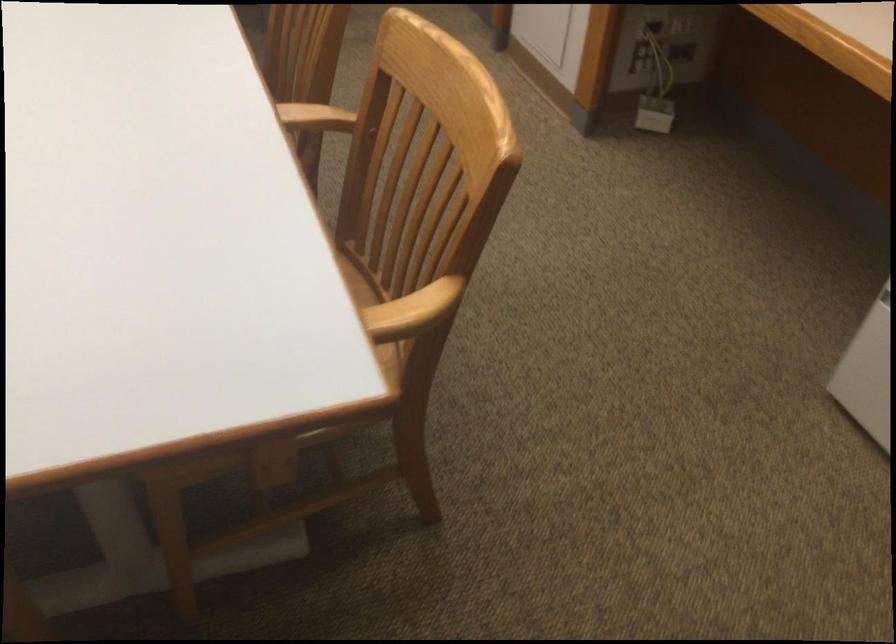
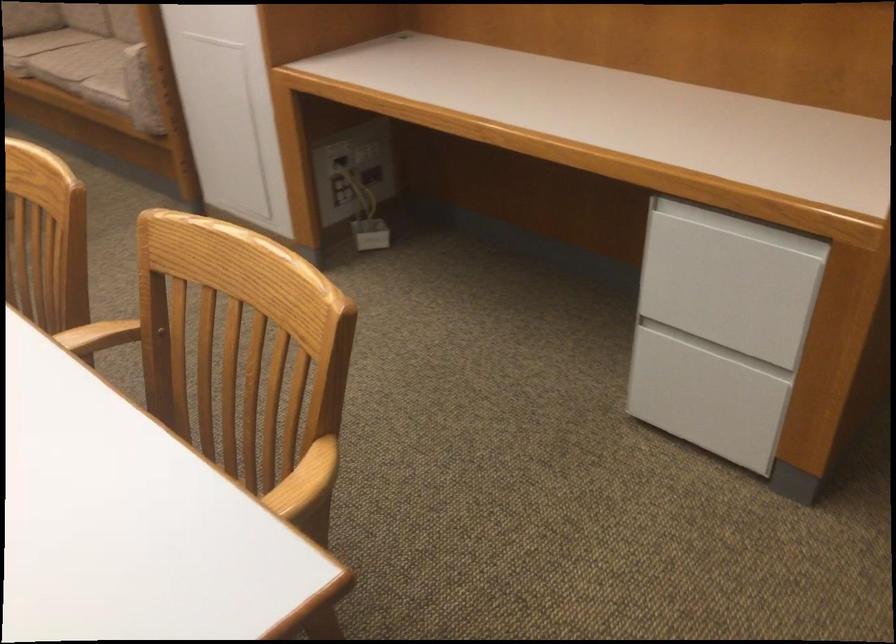
The point at (x=650, y=91) is marked in the first image. Where is the corresponding point in the second image?

(364, 214)